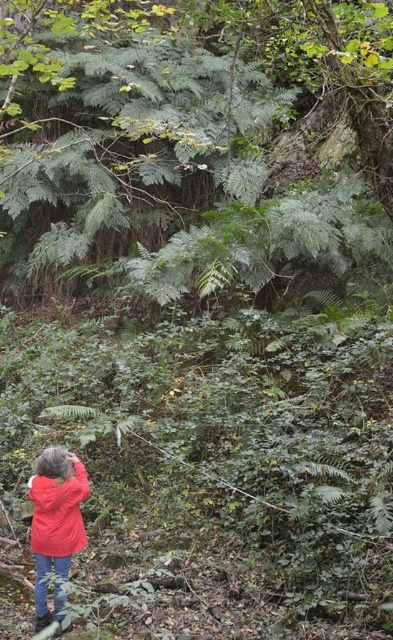
Does green leafy tree at upper center have a smaller size compared to red matte jacket at lower left?

Incorrect, green leafy tree at upper center is not smaller in size than red matte jacket at lower left.

Does point (203, 29) come closer to viewer compared to point (31, 486)?

No, (203, 29) is behind (31, 486).

Identify the location of green leafy tree at upper center. This screenshot has height=640, width=393. (187, 125).